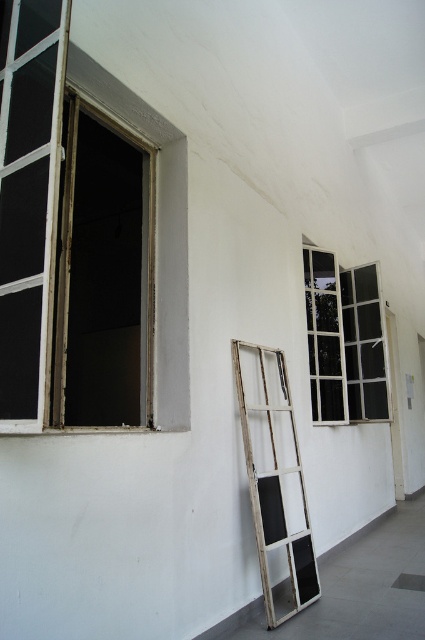
Question: Can you confirm if white wooden ladder at center is bigger than white glass window at center?

Choices:
 (A) no
 (B) yes

Answer: (B)

Question: Which point is farther from the camera taking this photo?

Choices:
 (A) (333, 292)
 (B) (280, 486)

Answer: (A)

Question: Can you confirm if white wooden ladder at center is wider than white glass window at center?

Choices:
 (A) no
 (B) yes

Answer: (B)

Question: Can you confirm if white wooden ladder at center is positioned to the right of white glass window at center?

Choices:
 (A) yes
 (B) no

Answer: (B)